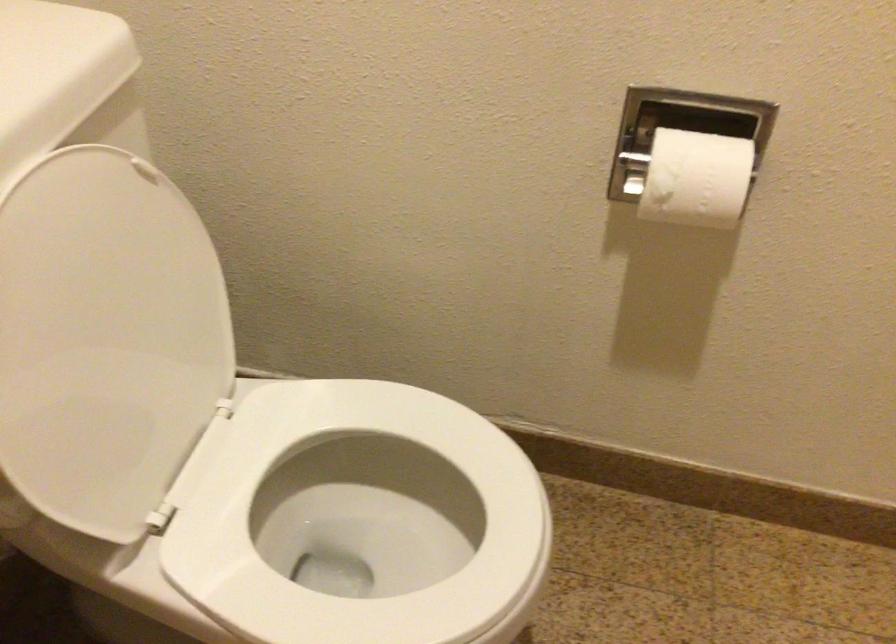
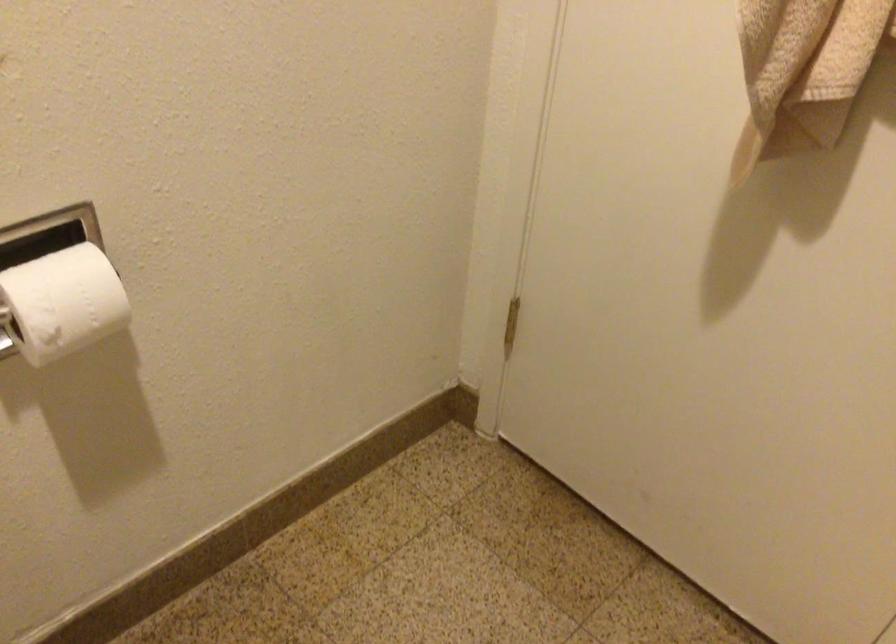
Question: The camera is either moving clockwise (left) or counter-clockwise (right) around the object. The first image is from the beginning of the video and the second image is from the end. Is the camera moving left or right when shooting the video?

Choices:
 (A) Left
 (B) Right

Answer: (A)